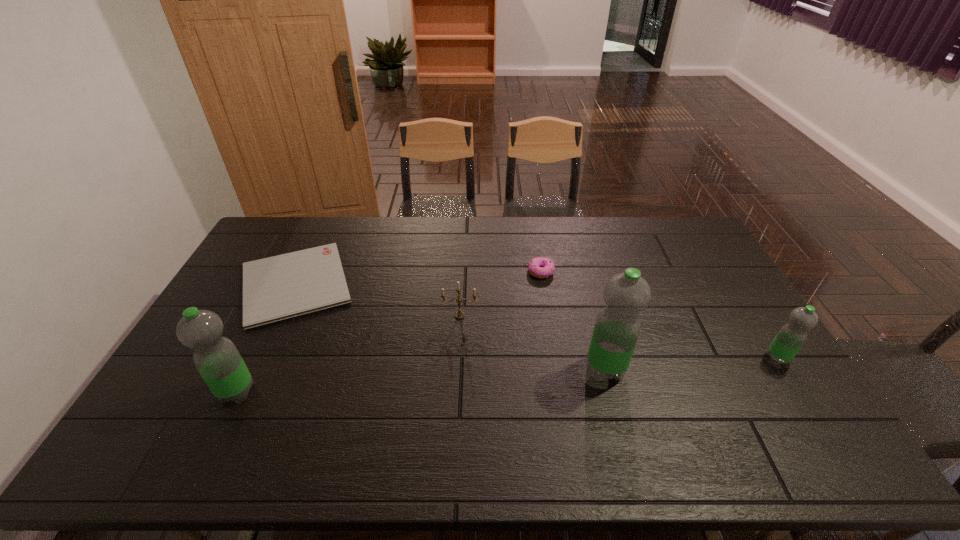
Locate which water bottle is the closest to the candle. Please provide its 2D coordinates. Your answer should be formatted as a tuple, i.e. [(x, y)], where the tuple contains the x and y coordinates of a point satisfying the conditions above.

[(617, 328)]

Select which water bottle appears as the closest to the clipboard. Please provide its 2D coordinates. Your answer should be formatted as a tuple, i.e. [(x, y)], where the tuple contains the x and y coordinates of a point satisfying the conditions above.

[(217, 359)]